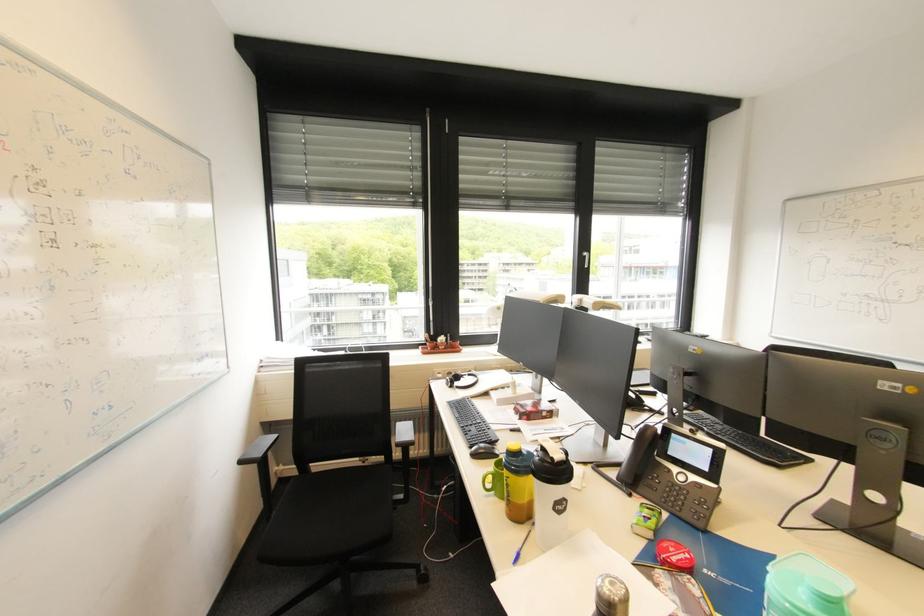
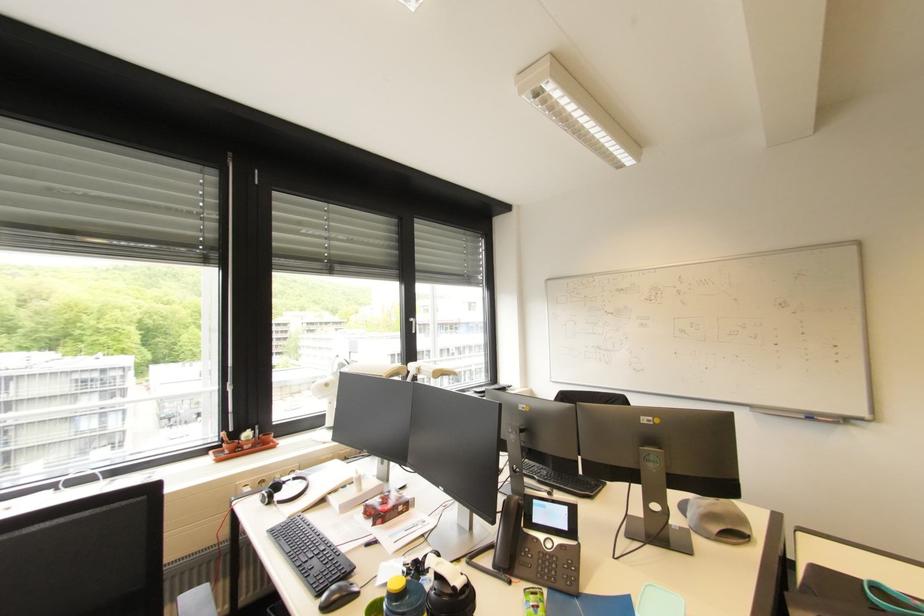
Locate, in the second image, the point that corresponds to point (446, 341) in the first image.

(252, 438)